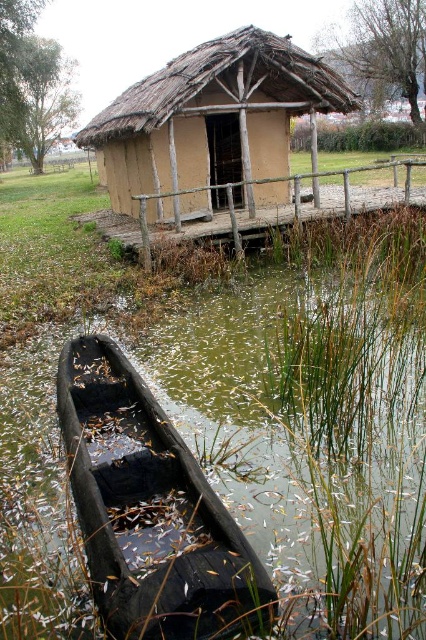
You are standing at the camera position and want to reach the point at coordinates (293, 292). Can you walk directly to that point from your current position?

The distance of point (293, 292) from camera is 9.22 meters, so yes, you can walk directly to that point from your current position as there is no obstruction mentioned in the scene description.

You are a delivery person carrying a package that is 1.5 meters wide. You need to move from the dock to the dark brown wooden boat at lower left while avoiding the green mossy water at bottom left. Is there enough space to pass safely?

The distance between the green mossy water at bottom left and the dark brown wooden boat at lower left is 1.62 meters. Since your package is 1.5 meters wide, there is enough space to pass safely as the gap is wider than the package.